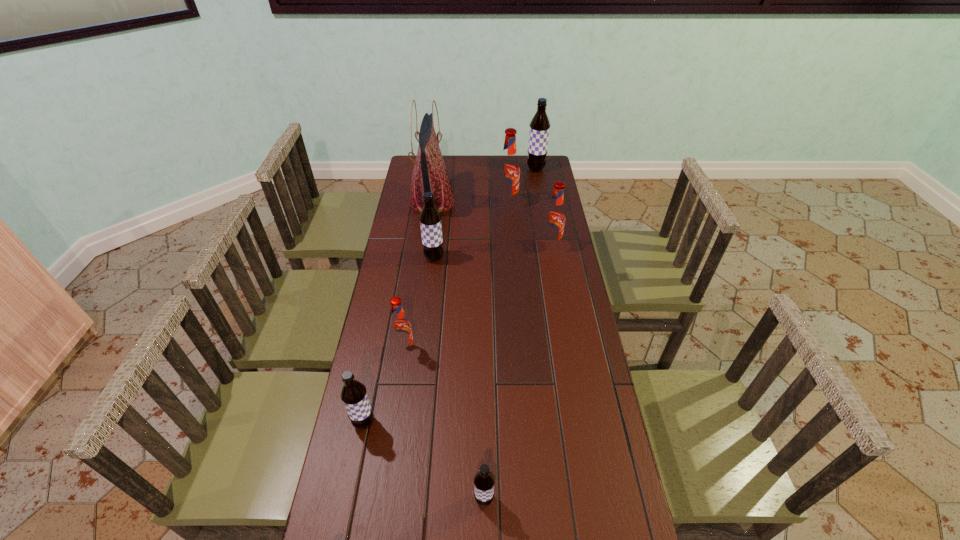
You are a GUI agent. You are given a task and a screenshot of the screen. Output one action in this format:
    pyautogui.click(x=<x>, y=<y>)
    Task: Click on the vacant region located 0.290m on the back of the sixth farthest object
    The image size is (960, 540).
    Given the screenshot: What is the action you would take?
    pyautogui.click(x=416, y=281)

Locate an element on the screen. This screenshot has width=960, height=540. blank space located 0.110m on the front of the leftmost root beer is located at coordinates (353, 474).

Identify the location of vacant region located on the left of the second brown root beer from right to left. The width and height of the screenshot is (960, 540). (395, 500).

Locate an element on the screen. Image resolution: width=960 pixels, height=540 pixels. object present at the far edge is located at coordinates (539, 130).

Image resolution: width=960 pixels, height=540 pixels. I want to click on handbag at the left edge, so click(x=430, y=174).

Locate an element on the screen. Image resolution: width=960 pixels, height=540 pixels. object at the far right corner is located at coordinates (539, 130).

Where is `free space at the far edge of the desktop`? The width and height of the screenshot is (960, 540). free space at the far edge of the desktop is located at coordinates (476, 177).

In the image, there is a desktop. What are the coordinates of `vacant space at the left edge` in the screenshot? It's located at (380, 295).

Find the location of `vacant space at the right edge of the desktop`. vacant space at the right edge of the desktop is located at coordinates (584, 316).

You are a GUI agent. You are given a task and a screenshot of the screen. Output one action in this format:
    pyautogui.click(x=<x>, y=<y>)
    Task: Click on the free region at the far right corner of the desktop
    The height and width of the screenshot is (540, 960).
    Given the screenshot: What is the action you would take?
    pyautogui.click(x=540, y=176)